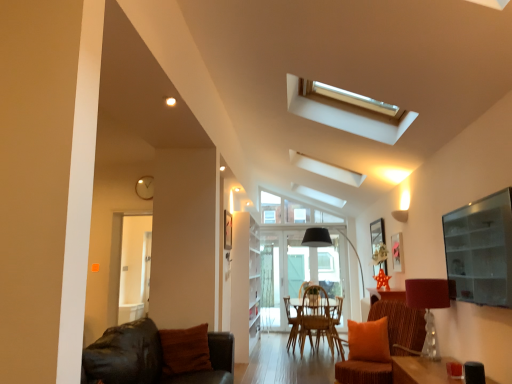
What do you see at coordinates (135, 268) in the screenshot? I see `transparent glass door at left, the 2th glass door in the right-to-left sequence` at bounding box center [135, 268].

Find the location of a particular element. This screenshot has width=512, height=384. transparent glass door at left, the 2th glass door in the right-to-left sequence is located at coordinates (135, 268).

What is the approximate height of orange fabric chair at lower right, which appears as the 1th chair when viewed from the front?

It is 86.31 centimeters.

In order to face transparent glass door at center, which is the first glass door from back to front, should I rotate leftwards or rightwards?

Turn right by 6.064 degrees to look at transparent glass door at center, which is the first glass door from back to front.

The width and height of the screenshot is (512, 384). What do you see at coordinates (294, 272) in the screenshot? I see `transparent glass door at center, which is the first glass door from back to front` at bounding box center [294, 272].

Measure the distance between point [433,349] and camera.

The distance of point [433,349] from camera is 3.41 meters.

Locate an element on the screen. Image resolution: width=512 pixels, height=384 pixels. transparent glass door at left, arranged as the first glass door when viewed from the front is located at coordinates (135, 268).

Based on their sizes in the image, would you say transparent glass door at center, the first glass door in the right-to-left sequence, is bigger or smaller than rustic wood chair at center, the first chair in the back-to-front sequence?

In the image, transparent glass door at center, the first glass door in the right-to-left sequence, appears to be smaller than rustic wood chair at center, the first chair in the back-to-front sequence.

Which is more to the right, transparent glass door at center, placed as the 2th glass door when sorted from left to right, or rustic wood chair at center, which appears as the 2th chair when viewed from the front?

Positioned to the right is transparent glass door at center, placed as the 2th glass door when sorted from left to right.

Is the surface of transparent glass door at center, placed as the 2th glass door when sorted from left to right, in direct contact with rustic wood chair at center, which appears as the 2th chair when viewed from the front?

transparent glass door at center, placed as the 2th glass door when sorted from left to right, is not next to rustic wood chair at center, which appears as the 2th chair when viewed from the front, and they're not touching.

Consider the image. Is transparent glass door at center, the 2th glass door positioned from the front, spatially inside rustic wood chair at center, which appears as the 2th chair when viewed from the front, or outside of it?

transparent glass door at center, the 2th glass door positioned from the front, is spatially situated outside rustic wood chair at center, which appears as the 2th chair when viewed from the front.

Is brown fuzzy pillow at lower left touching brown woven armchair at center?

No, brown fuzzy pillow at lower left is not next to brown woven armchair at center.

Considering the sizes of brown fuzzy pillow at lower left and brown woven armchair at center in the image, is brown fuzzy pillow at lower left wider or thinner than brown woven armchair at center?

In the image, brown fuzzy pillow at lower left appears to be more narrow than brown woven armchair at center.

Is brown fuzzy pillow at lower left situated inside brown woven armchair at center or outside?

brown fuzzy pillow at lower left exists outside the volume of brown woven armchair at center.

In terms of size, does rustic wood chair at center, the first chair in the back-to-front sequence, appear bigger or smaller than transparent glass door at center, placed as the 2th glass door when sorted from left to right?

rustic wood chair at center, the first chair in the back-to-front sequence, is bigger than transparent glass door at center, placed as the 2th glass door when sorted from left to right.

From a real-world perspective, is rustic wood chair at center, the first chair in the back-to-front sequence, beneath transparent glass door at center, which is the first glass door from back to front?

Yes.

From the image's perspective, is rustic wood chair at center, which appears as the 2th chair when viewed from the front, positioned above or below transparent glass door at center, the first glass door in the right-to-left sequence?

Based on their image positions, rustic wood chair at center, which appears as the 2th chair when viewed from the front, is located beneath transparent glass door at center, the first glass door in the right-to-left sequence.

Does rustic wood chair at center, which appears as the 2th chair when viewed from the front, have a greater width compared to transparent glass door at center, placed as the 2th glass door when sorted from left to right?

Indeed, rustic wood chair at center, which appears as the 2th chair when viewed from the front, has a greater width compared to transparent glass door at center, placed as the 2th glass door when sorted from left to right.

Is brown woven armchair at center bigger than brown fuzzy pillow at lower left?

Yes.

Is brown woven armchair at center oriented away from brown fuzzy pillow at lower left?

No, brown woven armchair at center is not facing the opposite direction of brown fuzzy pillow at lower left.

Is point (294, 326) behind point (201, 341)?

Yes.

From the image's perspective, which is below, brown woven armchair at center or brown fuzzy pillow at lower left?

brown woven armchair at center is shown below in the image.

Which of these two, translucent glass lampshade at right or transparent glass door at left, arranged as the second glass door when viewed from the back, stands shorter?

translucent glass lampshade at right.

From a real-world perspective, is translucent glass lampshade at right under transparent glass door at left, the 2th glass door in the right-to-left sequence?

Yes, from a real-world perspective, translucent glass lampshade at right is beneath transparent glass door at left, the 2th glass door in the right-to-left sequence.

Between translucent glass lampshade at right and transparent glass door at left, arranged as the first glass door when viewed from the front, which one has larger width?

Wider between the two is transparent glass door at left, arranged as the first glass door when viewed from the front.

From the image's perspective, is translucent glass lampshade at right located above or below transparent glass door at left, the 2th glass door in the right-to-left sequence?

Based on their image positions, translucent glass lampshade at right is located above transparent glass door at left, the 2th glass door in the right-to-left sequence.

From a real-world perspective, between rustic wood chair at center, which appears as the 2th chair when viewed from the front, and brown fuzzy pillow at lower left, who is vertically lower?

In real-world perspective, rustic wood chair at center, which appears as the 2th chair when viewed from the front, is lower.

In the scene shown: Can you confirm if rustic wood chair at center, the first chair in the back-to-front sequence, is wider than brown fuzzy pillow at lower left?

Correct, the width of rustic wood chair at center, the first chair in the back-to-front sequence, exceeds that of brown fuzzy pillow at lower left.

Which is behind, point (295, 309) or point (191, 368)?

The point (295, 309) is farther from the camera.

Could you tell me if translucent glass lampshade at right is turned towards orange fabric chair at lower right, which appears as the 1th chair when viewed from the front?

Yes, translucent glass lampshade at right faces towards orange fabric chair at lower right, which appears as the 1th chair when viewed from the front.

What's the angular difference between translucent glass lampshade at right and orange fabric chair at lower right, which appears as the 1th chair when viewed from the front,'s facing directions?

They differ by 44.8 degrees in their facing directions.

Is translucent glass lampshade at right closer to the viewer compared to orange fabric chair at lower right, arranged as the 2th chair when viewed from the back?

Yes, it is in front of orange fabric chair at lower right, arranged as the 2th chair when viewed from the back.

Locate an element on the screen. glass door on the right of rustic wood chair at center, the first chair in the back-to-front sequence is located at coordinates (294, 272).

Where is `pillow that appears on the left of brown woven armchair at center`? The image size is (512, 384). pillow that appears on the left of brown woven armchair at center is located at coordinates (185, 350).

When comparing their distances from rustic wood chair at center, the first chair in the back-to-front sequence, does translucent glass lampshade at right or orange fabric chair at lower right, which appears as the 1th chair when viewed from the front, seem closer?

Among the two, orange fabric chair at lower right, which appears as the 1th chair when viewed from the front, is located nearer to rustic wood chair at center, the first chair in the back-to-front sequence.

Considering their positions, is orange fabric chair at lower right, which appears as the 1th chair when viewed from the front, positioned further to brown woven armchair at center than rustic wood chair at center, which appears as the 2th chair when viewed from the front?

The object further to brown woven armchair at center is orange fabric chair at lower right, which appears as the 1th chair when viewed from the front.

Based on their spatial positions, is translucent glass lampshade at right or transparent glass door at left, arranged as the first glass door when viewed from the front, closer to brown fuzzy pillow at lower left?

Among the two, translucent glass lampshade at right is located nearer to brown fuzzy pillow at lower left.

Considering their positions, is rustic wood chair at center, which appears as the 2th chair when viewed from the front, positioned closer to transparent glass door at left, arranged as the first glass door when viewed from the front, than orange fabric chair at lower right, arranged as the 2th chair when viewed from the back?

The object closer to transparent glass door at left, arranged as the first glass door when viewed from the front, is rustic wood chair at center, which appears as the 2th chair when viewed from the front.

Estimate the real-world distances between objects in this image. Which object is closer to transparent glass door at center, the first glass door in the right-to-left sequence, orange fabric chair at lower right, arranged as the 2th chair when viewed from the back, or translucent glass lampshade at right?

Based on the image, orange fabric chair at lower right, arranged as the 2th chair when viewed from the back, appears to be nearer to transparent glass door at center, the first glass door in the right-to-left sequence.

Estimate the real-world distances between objects in this image. Which object is closer to transparent glass door at center, the 2th glass door positioned from the front, transparent glass door at left, arranged as the first glass door when viewed from the front, or brown woven armchair at center?

Based on the image, brown woven armchair at center appears to be nearer to transparent glass door at center, the 2th glass door positioned from the front.

From the image, which object appears to be farther from transparent glass door at center, the 2th glass door positioned from the front, brown woven armchair at center or translucent glass lampshade at right?

Based on the image, translucent glass lampshade at right appears to be further to transparent glass door at center, the 2th glass door positioned from the front.

Looking at the image, which one is located closer to brown woven armchair at center, transparent glass door at left, arranged as the first glass door when viewed from the front, or transparent glass door at center, the 2th glass door positioned from the front?

Based on the image, transparent glass door at center, the 2th glass door positioned from the front, appears to be nearer to brown woven armchair at center.

What are the coordinates of `glass door positioned between brown fuzzy pillow at lower left and transparent glass door at center, the first glass door in the right-to-left sequence, from near to far` in the screenshot? It's located at (135, 268).

The width and height of the screenshot is (512, 384). Identify the location of glass door located between orange fabric chair at lower right, arranged as the 2th chair when viewed from the back, and transparent glass door at center, the 2th glass door positioned from the front, in the depth direction. click(135, 268).

The height and width of the screenshot is (384, 512). Find the location of `chair located between orange fabric chair at lower right, which appears as the 1th chair when viewed from the front, and brown woven armchair at center in the depth direction`. chair located between orange fabric chair at lower right, which appears as the 1th chair when viewed from the front, and brown woven armchair at center in the depth direction is located at coordinates (291, 321).

The image size is (512, 384). What are the coordinates of `pillow between translucent glass lampshade at right and transparent glass door at center, placed as the 2th glass door when sorted from left to right, along the z-axis` in the screenshot? It's located at (185, 350).